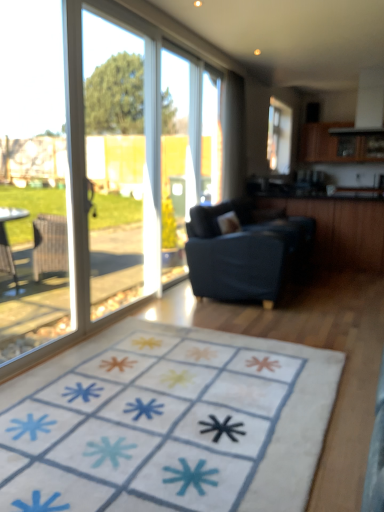
Question: From a real-world perspective, is white soft rug at center over transparent glass screen door at left?

Choices:
 (A) no
 (B) yes

Answer: (A)

Question: Is white soft rug at center positioned beyond the bounds of transparent glass screen door at left?

Choices:
 (A) yes
 (B) no

Answer: (A)

Question: Is white soft rug at center next to transparent glass screen door at left?

Choices:
 (A) yes
 (B) no

Answer: (B)

Question: Considering the relative sizes of white soft rug at center and transparent glass screen door at left in the image provided, is white soft rug at center thinner than transparent glass screen door at left?

Choices:
 (A) yes
 (B) no

Answer: (B)

Question: Is white soft rug at center turned away from transparent glass screen door at left?

Choices:
 (A) no
 (B) yes

Answer: (A)

Question: From the image's perspective, is transparent glass window at left, which is the 1th window screen from left to right, located above or below white sheer curtain at upper center?

Choices:
 (A) below
 (B) above

Answer: (A)

Question: Looking at their shapes, would you say transparent glass window at left, which ranks as the 2th window screen in right-to-left order, is wider or thinner than white sheer curtain at upper center?

Choices:
 (A) wide
 (B) thin

Answer: (B)

Question: Is transparent glass window at left, the second window screen when ordered from back to front, inside the boundaries of white sheer curtain at upper center, or outside?

Choices:
 (A) inside
 (B) outside

Answer: (B)

Question: From a real-world perspective, relative to white sheer curtain at upper center, is transparent glass window at left, which is the 1th window screen from left to right, vertically above or below?

Choices:
 (A) below
 (B) above

Answer: (A)

Question: Considering the positions of transparent plastic window screen at center, placed as the second window screen when sorted from front to back, and transparent glass screen door at left in the image, is transparent plastic window screen at center, placed as the second window screen when sorted from front to back, bigger or smaller than transparent glass screen door at left?

Choices:
 (A) small
 (B) big

Answer: (A)

Question: Would you say transparent plastic window screen at center, placed as the second window screen when sorted from front to back, is to the left or to the right of transparent glass screen door at left in the picture?

Choices:
 (A) left
 (B) right

Answer: (B)

Question: Considering the positions of point (213, 104) and point (147, 103), is point (213, 104) closer or farther from the camera than point (147, 103)?

Choices:
 (A) closer
 (B) farther

Answer: (A)

Question: In terms of height, does transparent plastic window screen at center, placed as the second window screen when sorted from front to back, look taller or shorter compared to transparent glass screen door at left?

Choices:
 (A) short
 (B) tall

Answer: (A)

Question: Looking at their shapes, would you say transparent plastic window screen at center, which is counted as the second window screen, starting from the left, is wider or thinner than white sheer curtain at upper center?

Choices:
 (A) thin
 (B) wide

Answer: (A)

Question: Is transparent plastic window screen at center, which is counted as the second window screen, starting from the left, in front of or behind white sheer curtain at upper center in the image?

Choices:
 (A) front
 (B) behind

Answer: (A)